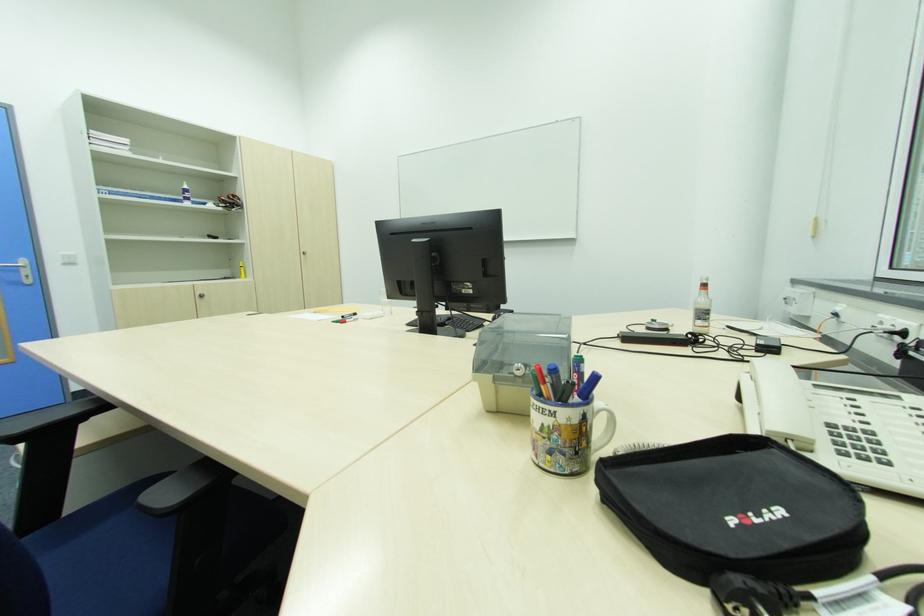
Find the location of a particular element. This screenshot has height=616, width=924. telephone handset is located at coordinates (783, 403).